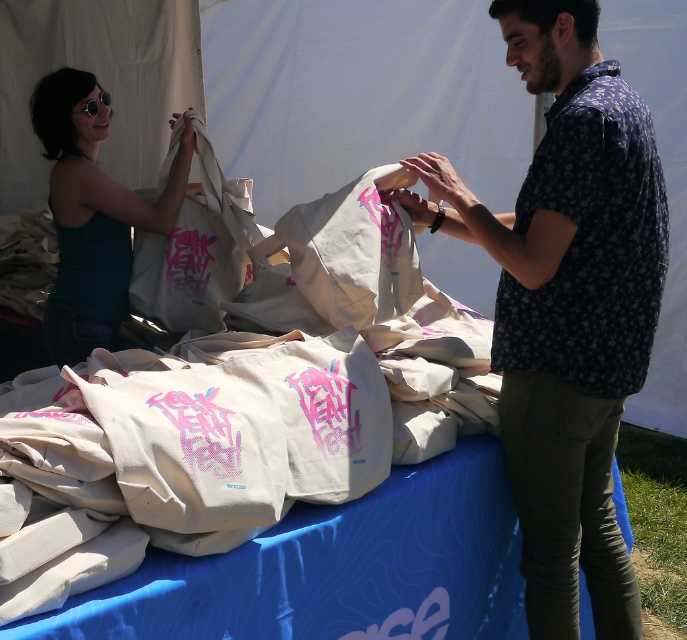
Which of these two, floral shirt at center or matte white tote bag at left, stands taller?

Standing taller between the two is floral shirt at center.

Is floral shirt at center to the left of matte white tote bag at left from the viewer's perspective?

No, floral shirt at center is not to the left of matte white tote bag at left.

Is point (592, 116) less distant than point (78, 214)?

Yes, point (592, 116) is closer to viewer.

The height and width of the screenshot is (640, 687). Find the location of `floral shirt at center`. floral shirt at center is located at coordinates (567, 307).